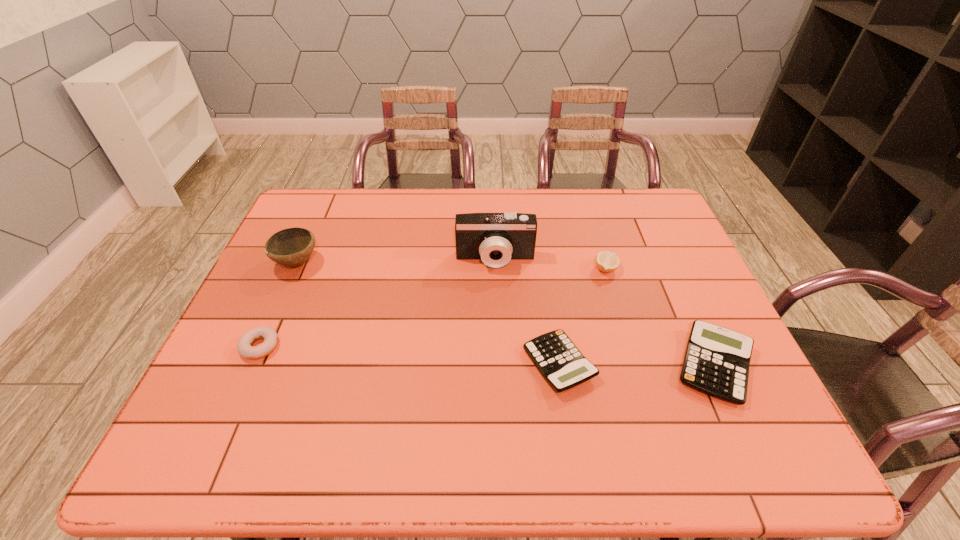
Find the location of a particular element. The height and width of the screenshot is (540, 960). vacant space located 0.270m on the front of the lemon is located at coordinates (633, 357).

Find the location of a particular element. The width and height of the screenshot is (960, 540). vacant space located on the right of the doughnut is located at coordinates (418, 347).

Locate an element on the screen. This screenshot has height=540, width=960. vacant space located on the front of the bowl is located at coordinates (274, 316).

Where is `doughnut at the left edge`? This screenshot has width=960, height=540. doughnut at the left edge is located at coordinates (244, 348).

The image size is (960, 540). I want to click on bowl that is at the left edge, so click(291, 247).

This screenshot has width=960, height=540. I want to click on object present at the right edge, so click(x=716, y=362).

Locate an element on the screen. The height and width of the screenshot is (540, 960). object present at the near right corner is located at coordinates (716, 362).

Identify the location of vacant space at the far edge. (610, 209).

Where is `free region at the near edge`? free region at the near edge is located at coordinates (421, 407).

The image size is (960, 540). In order to click on vacant area at the left edge in this screenshot , I will do `click(286, 284)`.